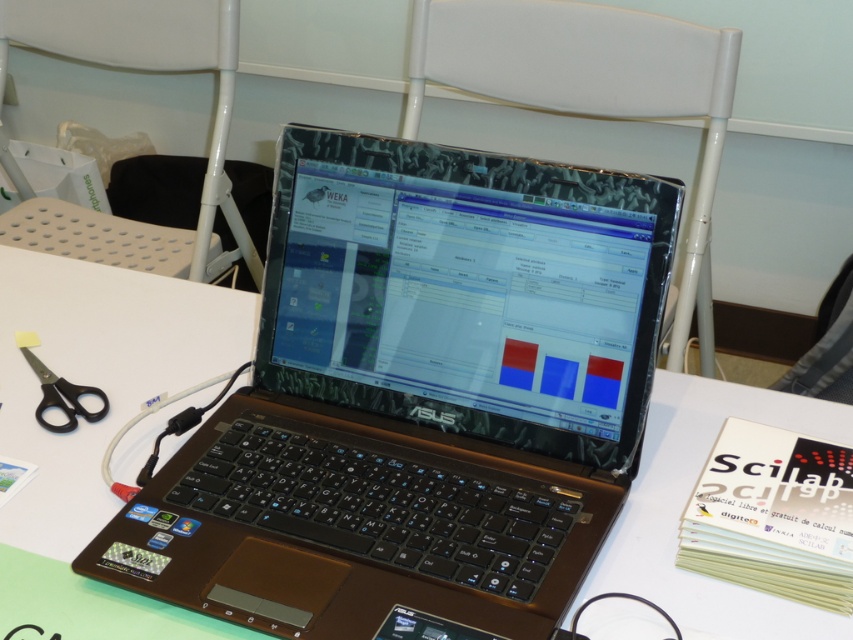
Question: Which point is closer to the camera?

Choices:
 (A) white plastic chair at upper center
 (B) black plastic scissors at lower left
 (C) brown matte laptop at center
 (D) white fabric chair at center

Answer: (C)

Question: Estimate the real-world distances between objects in this image. Which object is closer to the black plastic scissors at lower left?

Choices:
 (A) white fabric chair at center
 (B) brown matte laptop at center
 (C) white plastic chair at upper center

Answer: (B)

Question: Is white fabric chair at center positioned in front of white plastic chair at upper center?

Choices:
 (A) no
 (B) yes

Answer: (B)

Question: Does brown matte laptop at center appear on the right side of white fabric chair at center?

Choices:
 (A) yes
 (B) no

Answer: (B)

Question: Does brown matte laptop at center come behind black plastic scissors at lower left?

Choices:
 (A) yes
 (B) no

Answer: (B)

Question: Among these objects, which one is farthest from the camera?

Choices:
 (A) black plastic scissors at lower left
 (B) white fabric chair at center

Answer: (B)